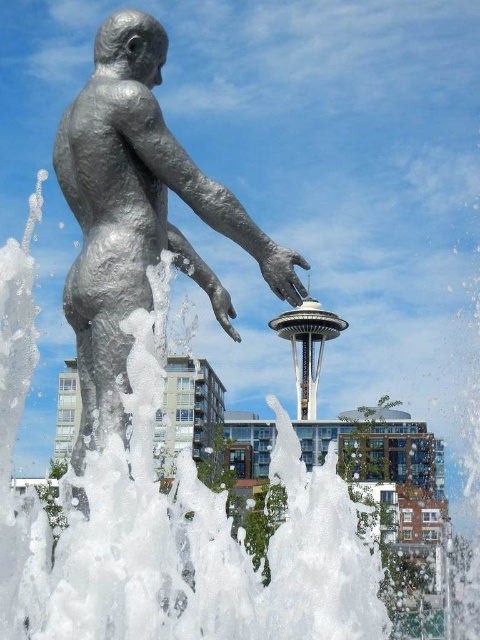
You are an architect designing a new plaza and want to place a bench for visitors to view the shiny silver statue at center. According to the coordinates provided, where should you place the bench to ensure it faces the statue directly?

The shiny silver statue at center is located at coordinates point (136, 216), so the bench should be placed in front of this point to face it directly.

You are a photographer standing at the camera position. You want to capture the shiny silver statue at center in your photo. The statue is 24.90 meters away. Your camera has a minimum focus distance of 25 meters. Can you focus on the statue clearly?

The shiny silver statue at center is 24.90 meters away from the camera. Since the minimum focus distance of your camera is 25 meters, the statue is just slightly too close to be focused clearly. You might need to step back a bit or use a different lens to ensure sharpness.